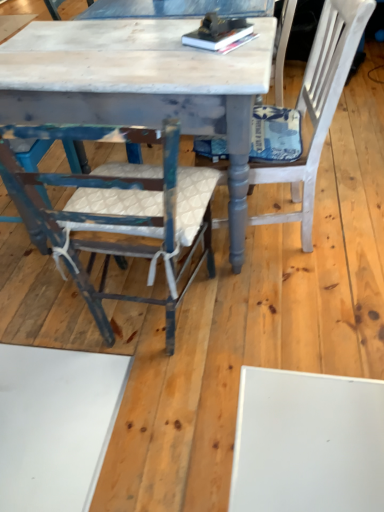
Find the location of a particular element. The height and width of the screenshot is (512, 384). vacant space situated above hardcover books at center (from a real-world perspective) is located at coordinates (220, 25).